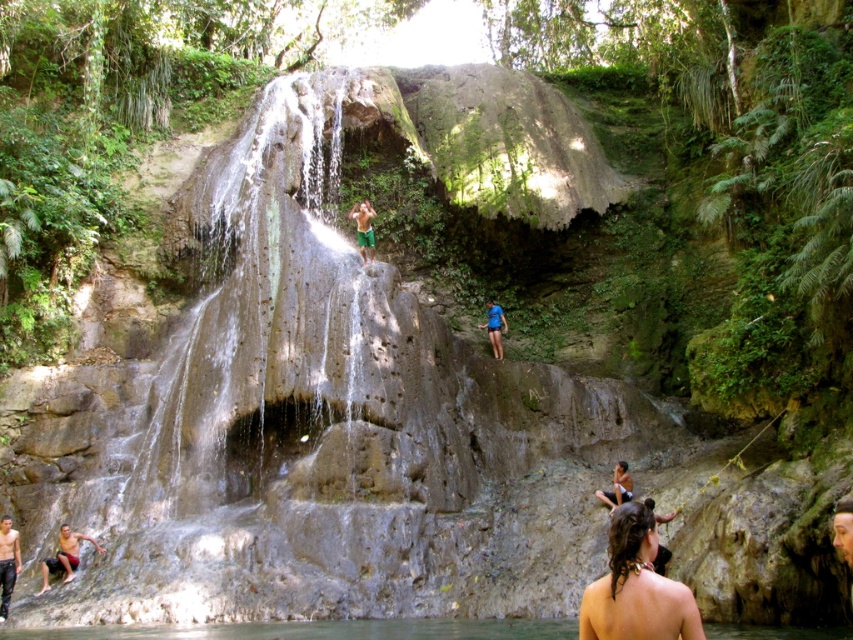
Measure the distance between brown hair at lower right and camera.

brown hair at lower right is 24.82 meters away from camera.

The width and height of the screenshot is (853, 640). Identify the location of brown hair at lower right. (636, 588).

From the picture: Between clear water at bottom center and dark brown leather shorts at lower left, which one has more height?

clear water at bottom center is taller.

Is clear water at bottom center to the right of dark brown leather shorts at lower left from the viewer's perspective?

Yes, clear water at bottom center is to the right of dark brown leather shorts at lower left.

Image resolution: width=853 pixels, height=640 pixels. Identify the location of clear water at bottom center. (318, 628).

What are the coordinates of `clear water at bottom center` in the screenshot? It's located at (318, 628).

Does matte skin person at lower left lie in front of smooth skin person at lower right?

That is True.

Is the position of matte skin person at lower left more distant than that of smooth skin person at lower right?

No, matte skin person at lower left is in front of smooth skin person at lower right.

Who is more distant from viewer, (68, 568) or (619, 480)?

Positioned behind is point (619, 480).

Identify the location of matte skin person at lower left. (64, 556).